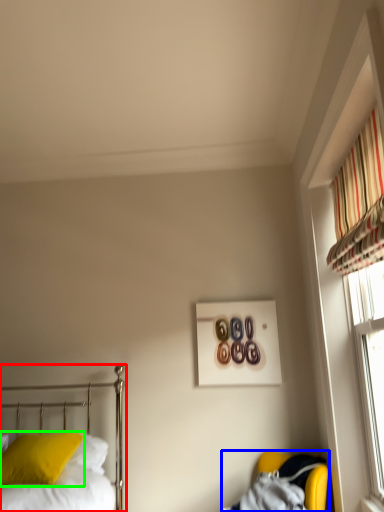
Question: Based on their relative distances, which object is farther from bed (highlighted by a red box)? Choose from armchair (highlighted by a blue box) and pillow (highlighted by a green box).

Choices:
 (A) armchair
 (B) pillow

Answer: (A)